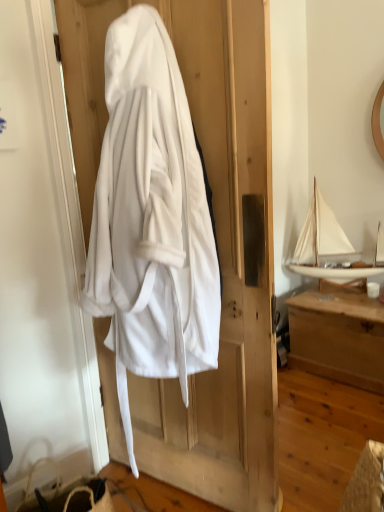
Question: Is white fabric screen door at left taller than white wooden boat at upper right?

Choices:
 (A) no
 (B) yes

Answer: (B)

Question: Is white fabric screen door at left to the right of white wooden boat at upper right from the viewer's perspective?

Choices:
 (A) no
 (B) yes

Answer: (A)

Question: From the image's perspective, is white fabric screen door at left under white wooden boat at upper right?

Choices:
 (A) no
 (B) yes

Answer: (B)

Question: Does white fabric screen door at left have a lesser height compared to white wooden boat at upper right?

Choices:
 (A) yes
 (B) no

Answer: (B)

Question: Is the position of white fabric screen door at left less distant than that of white wooden boat at upper right?

Choices:
 (A) no
 (B) yes

Answer: (B)

Question: Is white fabric screen door at left facing towards white wooden boat at upper right?

Choices:
 (A) yes
 (B) no

Answer: (A)

Question: From the image's perspective, is white soft robe at center beneath wooden chest at right?

Choices:
 (A) yes
 (B) no

Answer: (B)

Question: Are white soft robe at center and wooden chest at right making contact?

Choices:
 (A) yes
 (B) no

Answer: (B)

Question: Considering the relative sizes of white soft robe at center and wooden chest at right in the image provided, is white soft robe at center thinner than wooden chest at right?

Choices:
 (A) no
 (B) yes

Answer: (B)

Question: Can you confirm if white soft robe at center is positioned to the left of wooden chest at right?

Choices:
 (A) yes
 (B) no

Answer: (A)

Question: Is white soft robe at center not close to wooden chest at right?

Choices:
 (A) no
 (B) yes

Answer: (B)

Question: Is white soft robe at center taller than wooden chest at right?

Choices:
 (A) no
 (B) yes

Answer: (B)

Question: From the image's perspective, is white soft robe at center over white fabric screen door at left?

Choices:
 (A) yes
 (B) no

Answer: (A)